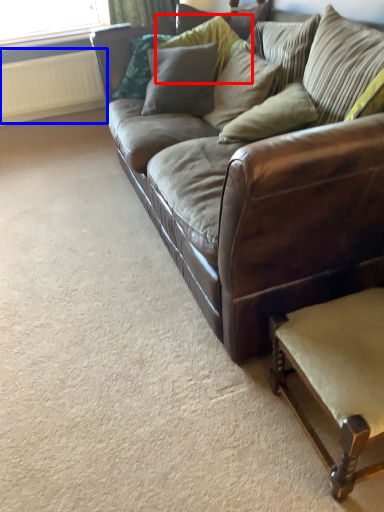
Question: Among these objects, which one is farthest to the camera, pillow (highlighted by a red box) or radiator (highlighted by a blue box)?

Choices:
 (A) pillow
 (B) radiator

Answer: (B)